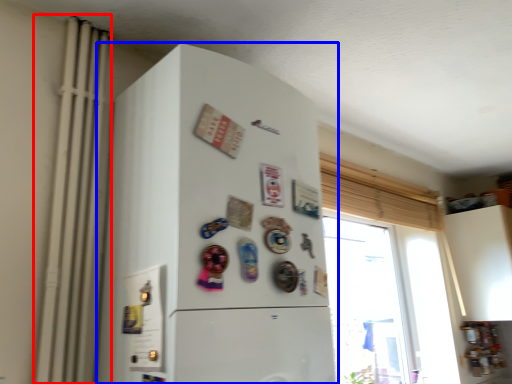
Question: Which of the following is the closest to the observer, radiator (highlighted by a red box) or refrigerator (highlighted by a blue box)?

Choices:
 (A) radiator
 (B) refrigerator

Answer: (B)